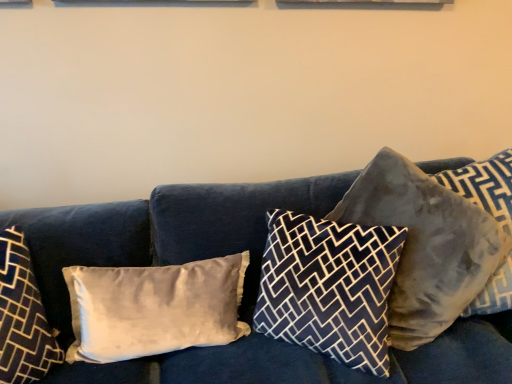
Question: From a real-world perspective, is satin beige pillow at left, which appears as the 4th pillow when viewed from the right, positioned above or below velvet gray pillow at right, which ranks as the 4th pillow in left-to-right order?

Choices:
 (A) below
 (B) above

Answer: (A)

Question: In terms of width, does satin beige pillow at left, which appears as the 4th pillow when viewed from the right, look wider or thinner when compared to velvet gray pillow at right, arranged as the second pillow when viewed from the right?

Choices:
 (A) thin
 (B) wide

Answer: (A)

Question: Which of these objects is positioned farthest from the satin beige pillow at left, which is the 2th pillow from left to right?

Choices:
 (A) velvet gray pillow at right, arranged as the second pillow when viewed from the right
 (B) velvet blue couch at center
 (C) velvety gray pillow at right, the fifth pillow from the left
 (D) velvet white pillow at left, marked as the fifth pillow in a right-to-left arrangement
 (E) dark blue patterned pillow at center, which is the 3th pillow from right to left

Answer: (C)

Question: Which of these objects is positioned farthest from the velvet white pillow at left, acting as the first pillow starting from the left?

Choices:
 (A) satin beige pillow at left, which is the 2th pillow from left to right
 (B) velvet blue couch at center
 (C) velvet gray pillow at right, which ranks as the 4th pillow in left-to-right order
 (D) dark blue patterned pillow at center, which is the 3th pillow in left-to-right order
 (E) velvety gray pillow at right, the fifth pillow from the left

Answer: (E)